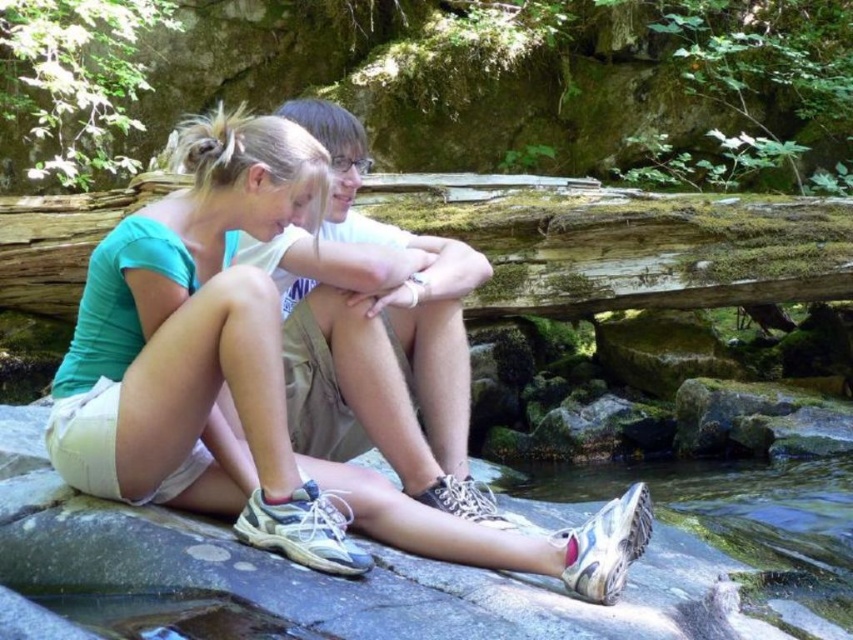
Which is behind, point (392, 456) or point (691, 243)?

The point (691, 243) is more distant.

Can you confirm if matte white shorts at center is bigger than weathered wood log at center?

Actually, matte white shorts at center might be smaller than weathered wood log at center.

What are the coordinates of `matte white shorts at center` in the screenshot? It's located at (276, 384).

Where is `weathered wood log at center`? The height and width of the screenshot is (640, 853). weathered wood log at center is located at coordinates (624, 241).

Between point (544, 192) and point (519, 488), which one is positioned behind?

The point (544, 192) is more distant.

This screenshot has width=853, height=640. I want to click on weathered wood log at center, so click(624, 241).

Between point (154, 419) and point (575, 468), which one is positioned in front?

Positioned in front is point (154, 419).

Can you confirm if matte white shorts at center is taller than white rubber shoe at lower center?

Yes.

Is point (398, 508) positioned after point (804, 541)?

No.

Where is `matte white shorts at center`? The width and height of the screenshot is (853, 640). matte white shorts at center is located at coordinates (276, 384).